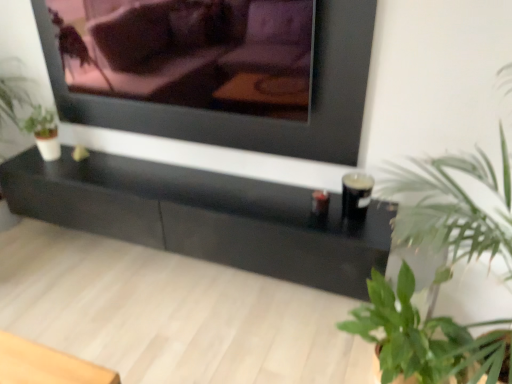
The image size is (512, 384). Find the location of `free region under black glossy table at center (from a real-world perspective)`. free region under black glossy table at center (from a real-world perspective) is located at coordinates (189, 269).